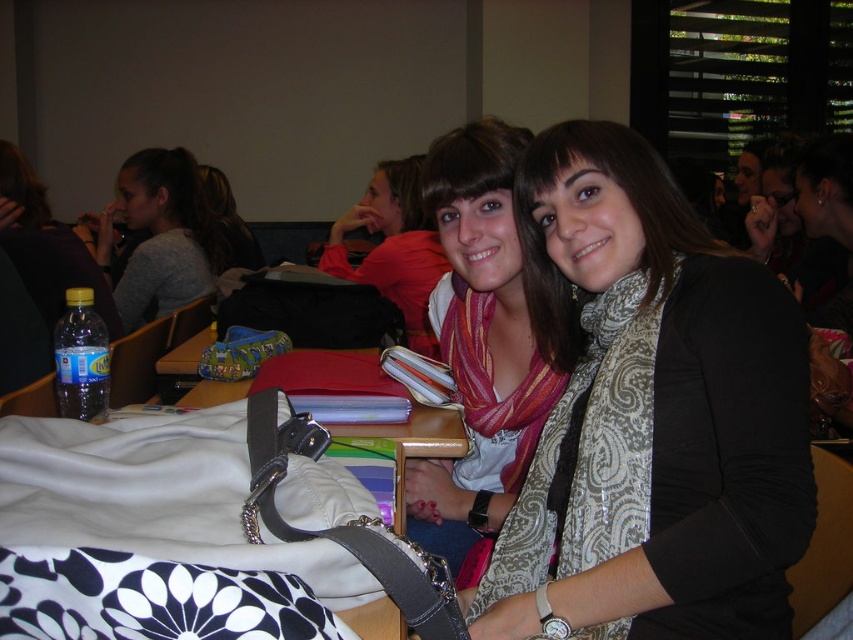
You are organizing a photo shoot and need to ensure that the matte pink scarf at center and the matte red sweater at center are positioned exactly 36 inches apart for a closeup shot. Based on the current arrangement in the image, will you need to move either item to achieve this requirement?

The matte pink scarf at center and the matte red sweater at center are currently 38.29 inches apart. Since the required distance is 36 inches, you will need to move either the matte pink scarf at center or the matte red sweater at center closer by approximately 2.29 inches to meet the 36 inch requirement.

You are a photographer trying to capture a closeup of the patterned scarf at center and the matte pink scarf at center. Since you can only focus on one scarf at a time, which scarf should you focus on first to ensure the other is still in focus?

The patterned scarf at center is located below matte pink scarf at center. Since the matte pink scarf at center is higher up, focusing on it first would allow the patterned scarf at center to remain in focus as it is positioned lower.

You are a photographer standing in the classroom. You want to take a photo of the two subjects wearing the patterned scarf at center and the matte red sweater at center. If your camera has a maximum focus range of 1.5 meters, will you be able to capture both subjects in focus at the same time?

The distance between the patterned scarf at center and the matte red sweater at center is 1.37 meters. Since the camera can focus up to 1.5 meters, both subjects can be captured in focus simultaneously.